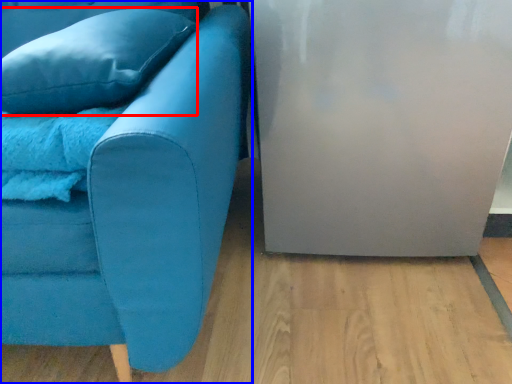
Question: Which object is further to the camera taking this photo, pillow (highlighted by a red box) or studio couch (highlighted by a blue box)?

Choices:
 (A) pillow
 (B) studio couch

Answer: (A)